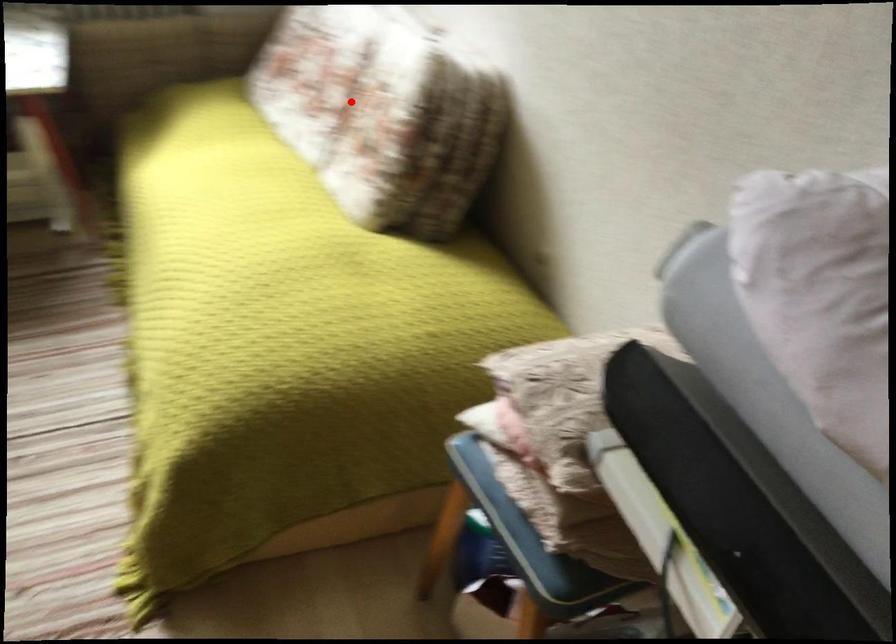
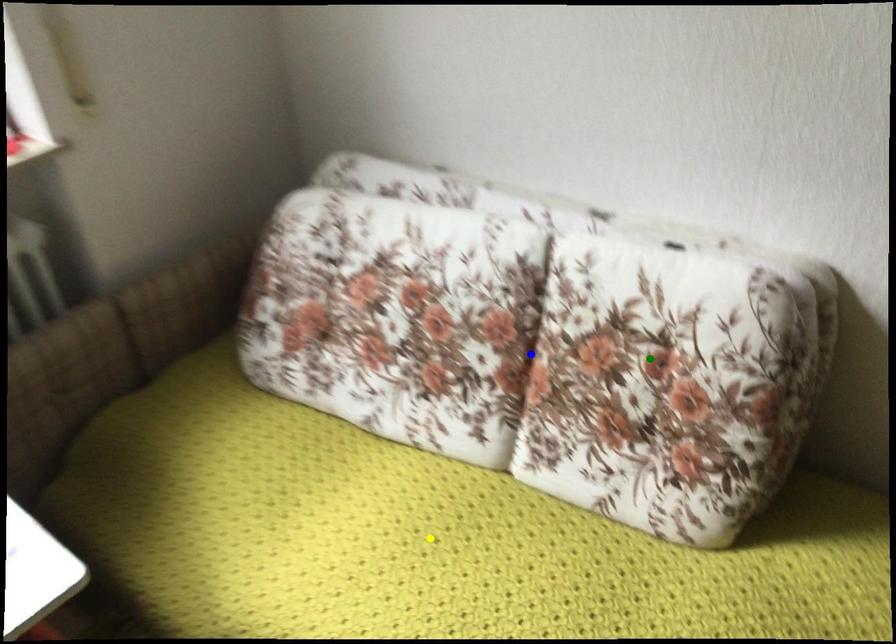
Question: I am providing you with two images of the same scene from different viewpoints. A red point is marked on the first image. You are given multiple points on the second image. In image 2, which mark is for the same physical point as the one in image 1?

Choices:
 (A) green point
 (B) blue point
 (C) yellow point

Answer: (B)